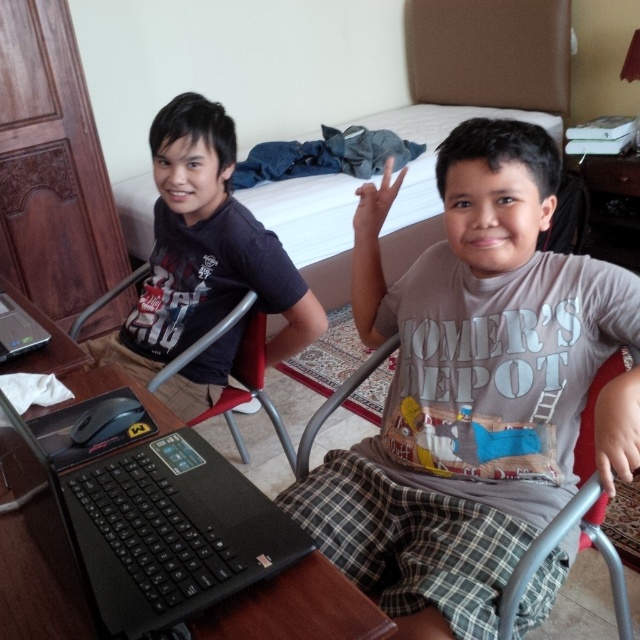
You are a photographer taking a picture of the scene. You need to ensure that both the matte black shirt at left and the black matte laptop at left are clearly visible in the frame. Based on their positions, which object should you focus on first to ensure both are in focus?

The matte black shirt at left is to the right of the black matte laptop at left. To ensure both are in focus, you should focus on the black matte laptop at left first, as it is closer to the camera, and then adjust to include the matte black shirt at left in the frame.

You are a photographer standing in front of the two people in the hotel room. You want to take a photo that captures both the matte black shirt at left and the black matte laptop at left clearly. Which object should you focus on first to ensure both are in focus?

You should focus on the matte black shirt at left first because it is closer to you than the black matte laptop at left, so focusing on the closer object will help both be in focus.

You are a photographer setting up a shoot in the hotel room. You need to ensure that the matte black shirt at left and the red plastic chair at left are both visible in the frame. Based on their positions, which object is covering the other?

The matte black shirt at left is positioned over the red plastic chair at left, so the shirt is covering the chair in the image.